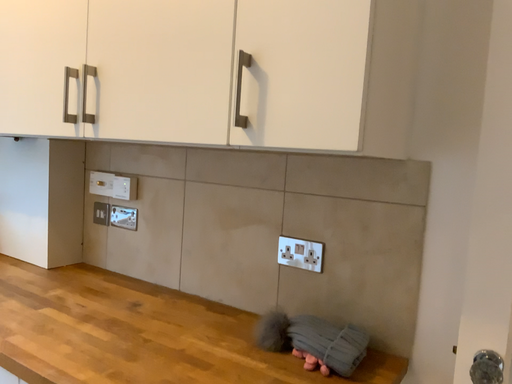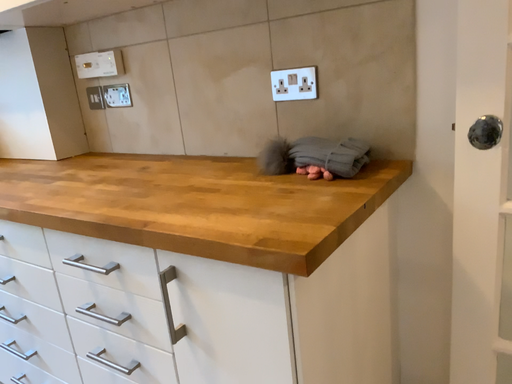
Question: Which way did the camera rotate in the video?

Choices:
 (A) rotated upward
 (B) rotated downward

Answer: (B)